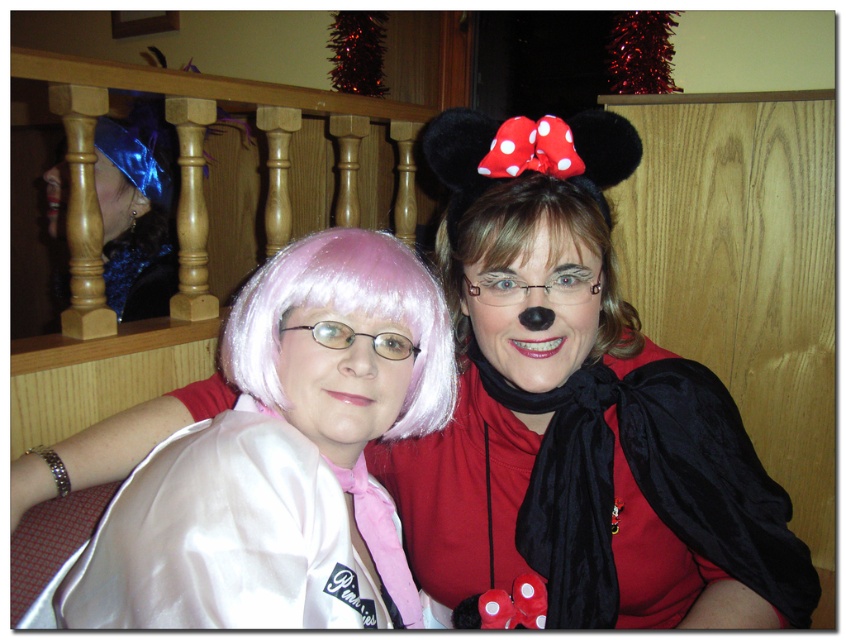
You are a photographer setting up for a group photo. You notice the velvet black cape at right and the satin white cape at center in the scene. Which cape should you position closer to the background to avoid blocking the view of the wooden paneling behind?

The velvet black cape at right should be positioned closer to the background because it is much taller than the satin white cape at center, so placing it further back will prevent it from obstructing the view of the wooden paneling.

You are at a costume party and need to locate the velvet black cape at right and the blue satin wig at upper left. Which one is positioned to the right of the other?

The velvet black cape at right is positioned to the right of the blue satin wig at upper left.